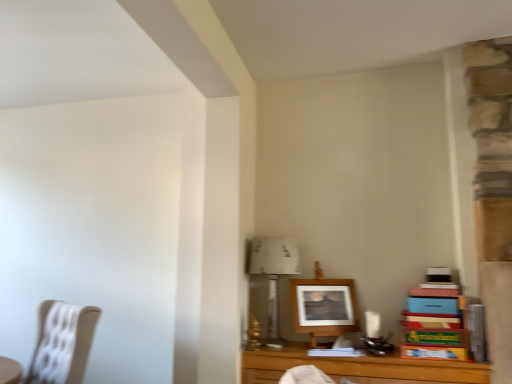
Question: Can you confirm if white paper at upper center is bigger than wooden table at lower right?

Choices:
 (A) yes
 (B) no

Answer: (B)

Question: Is wooden table at lower right surrounded by white paper at upper center?

Choices:
 (A) no
 (B) yes

Answer: (A)

Question: Is white paper at upper center oriented away from wooden table at lower right?

Choices:
 (A) yes
 (B) no

Answer: (B)

Question: Considering the relative positions of white paper at upper center and wooden table at lower right in the image provided, is white paper at upper center to the left of wooden table at lower right from the viewer's perspective?

Choices:
 (A) yes
 (B) no

Answer: (A)

Question: Does white paper at upper center lie in front of wooden table at lower right?

Choices:
 (A) no
 (B) yes

Answer: (A)

Question: Does point click(367, 377) appear closer or farther from the camera than point click(283, 271)?

Choices:
 (A) closer
 (B) farther

Answer: (A)

Question: Looking at their shapes, would you say wooden table at lower right is wider or thinner than white paper at upper center?

Choices:
 (A) thin
 (B) wide

Answer: (B)

Question: In terms of height, does wooden table at lower right look taller or shorter compared to white paper at upper center?

Choices:
 (A) short
 (B) tall

Answer: (A)

Question: From a real-world perspective, is wooden table at lower right physically located above or below white paper at upper center?

Choices:
 (A) below
 (B) above

Answer: (A)

Question: Is wooden frame at center wider or thinner than white paper at upper center?

Choices:
 (A) thin
 (B) wide

Answer: (A)

Question: In terms of height, does wooden frame at center look taller or shorter compared to white paper at upper center?

Choices:
 (A) tall
 (B) short

Answer: (B)

Question: From the image's perspective, is wooden frame at center above or below white paper at upper center?

Choices:
 (A) above
 (B) below

Answer: (B)

Question: In terms of size, does wooden frame at center appear bigger or smaller than white paper at upper center?

Choices:
 (A) small
 (B) big

Answer: (A)

Question: Based on their positions, is white paper at upper center located to the left or right of wooden frame at center?

Choices:
 (A) left
 (B) right

Answer: (A)

Question: From a real-world perspective, is white paper at upper center positioned above or below wooden frame at center?

Choices:
 (A) above
 (B) below

Answer: (A)